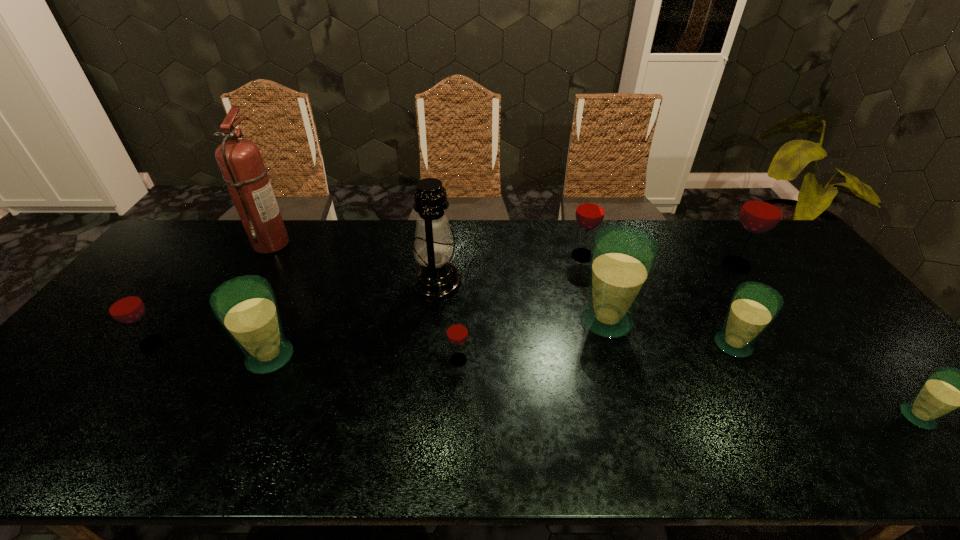
What are the coordinates of `the second smallest red glass` in the screenshot? It's located at (123, 304).

What are the coordinates of `the leftmost object` in the screenshot? It's located at (123, 304).

Find the location of a particular element. the sixth glass from left to right is located at coordinates (754, 306).

This screenshot has height=540, width=960. What are the coordinates of `the third object from right to left` in the screenshot? It's located at (754, 306).

At what (x,y) coordinates should I click in order to perform the action: click on the smallest red glass. Please return your answer as a coordinate pair (x, y). Looking at the image, I should click on (457, 331).

Identify the location of the third glass from left to right. Image resolution: width=960 pixels, height=540 pixels. (457, 331).

Find the location of a particular element. The image size is (960, 540). the smallest blue glass is located at coordinates (946, 389).

In order to click on the nearest blue glass in this screenshot , I will do `click(946, 389)`.

What are the coordinates of `vacant space located on the front-facing side of the ninth object from right to left` in the screenshot? It's located at (387, 243).

The width and height of the screenshot is (960, 540). In order to click on blank space located on the left of the oil lamp in this screenshot , I will do `click(357, 283)`.